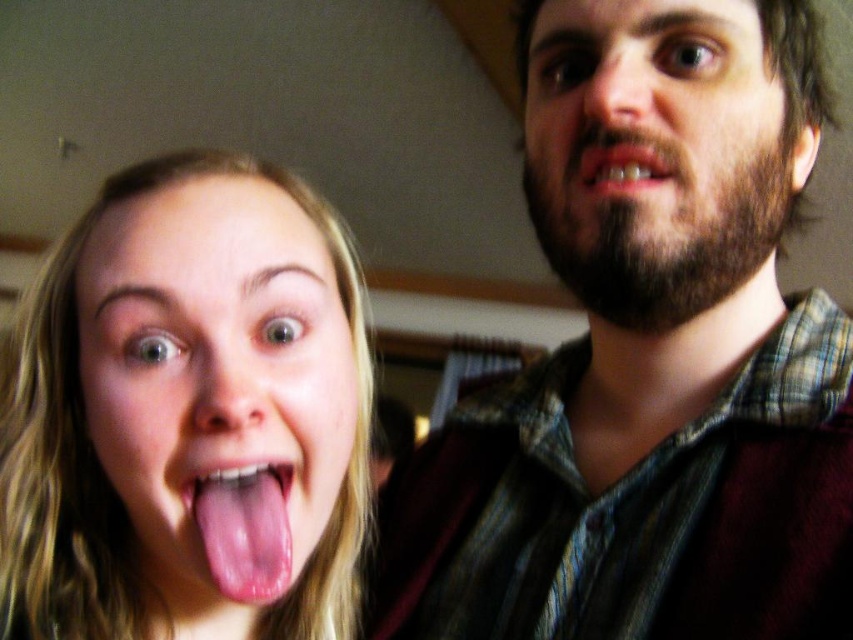
Question: Based on their relative distances, which object is farther from the pink flesh at center?

Choices:
 (A) pink glossy lips at upper center
 (B) pink flesh-colored tongue at lower left
 (C) beardhairman at right
 (D) bearded man at upper right

Answer: (A)

Question: Which object appears farthest from the camera in this image?

Choices:
 (A) bearded man at upper right
 (B) pink flesh at center

Answer: (A)

Question: Which object is the closest to the pink flesh-colored tongue at lower left?

Choices:
 (A) pink flesh at center
 (B) beardhairman at right
 (C) pink glossy lips at upper center

Answer: (A)

Question: Does pink flesh at center have a larger size compared to beardhairman at right?

Choices:
 (A) no
 (B) yes

Answer: (A)

Question: Does pink flesh at center appear on the right side of pink glossy lips at upper center?

Choices:
 (A) no
 (B) yes

Answer: (A)

Question: Does bearded man at upper right have a smaller size compared to beardhairman at right?

Choices:
 (A) no
 (B) yes

Answer: (A)